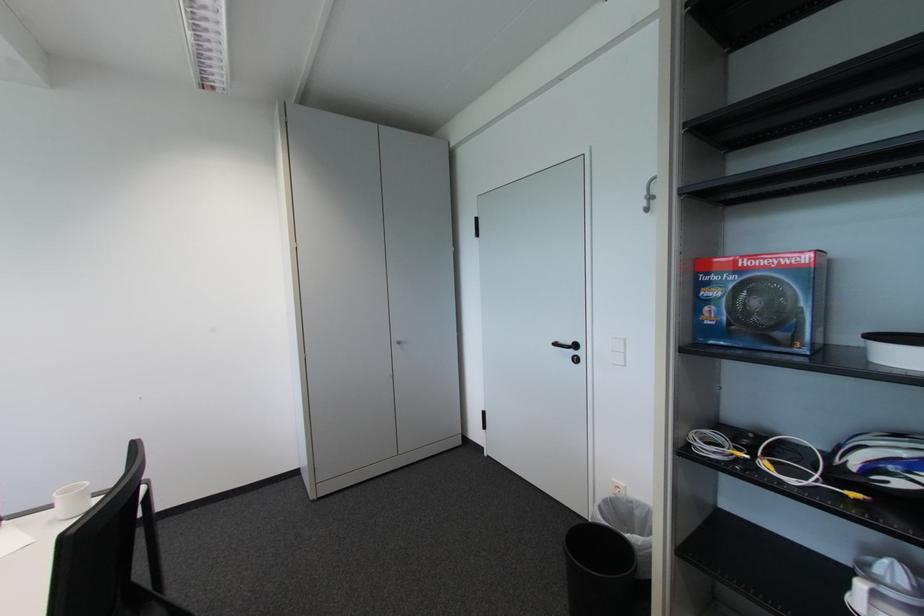
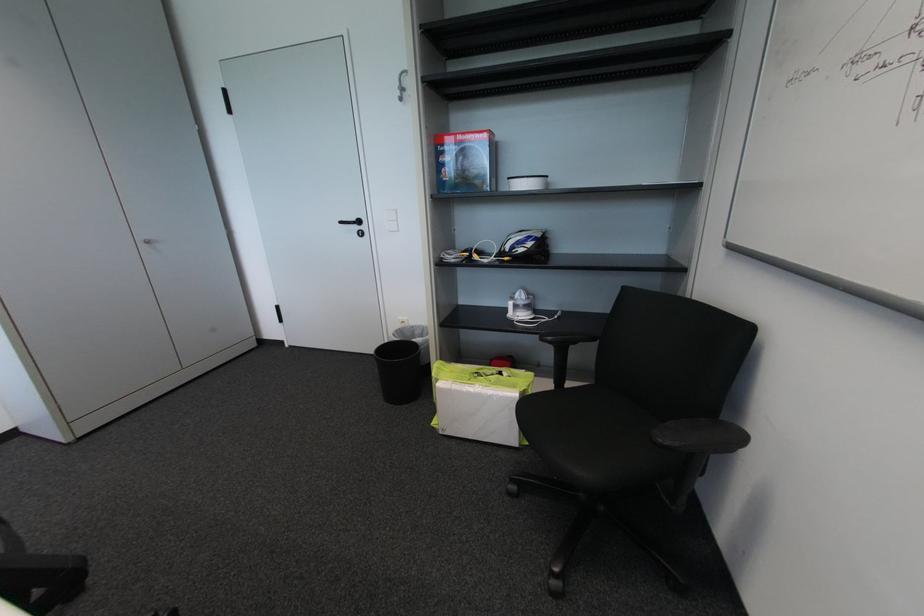
In the second image, find the point that corresponds to (x=578, y=353) in the first image.

(362, 229)